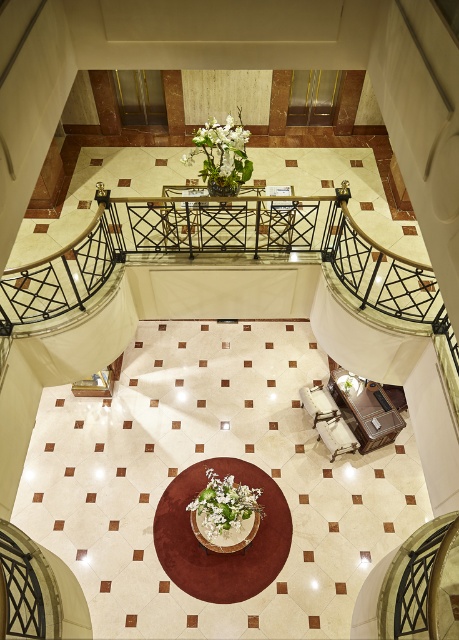
You are standing at the entrance of the lobby and see the point marked at coordinates (224, 509). What object is located at that point?

The point at coordinates (224, 509) marks the white matte flower at center.

Based on the provided scene description, what is the location of the point with coordinates (x=207, y=458)?

The point with coordinates (x=207, y=458) corresponds to the white marble atrium at center.